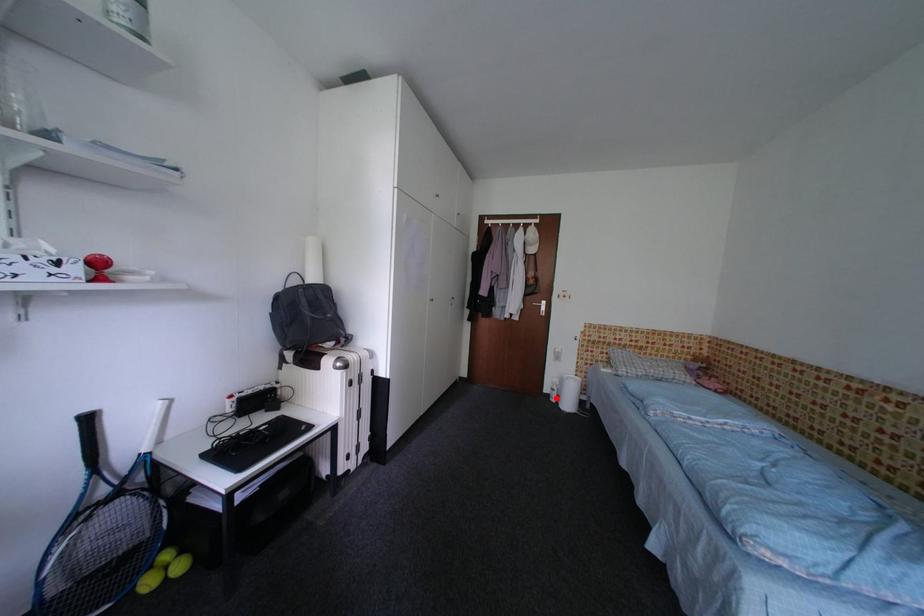
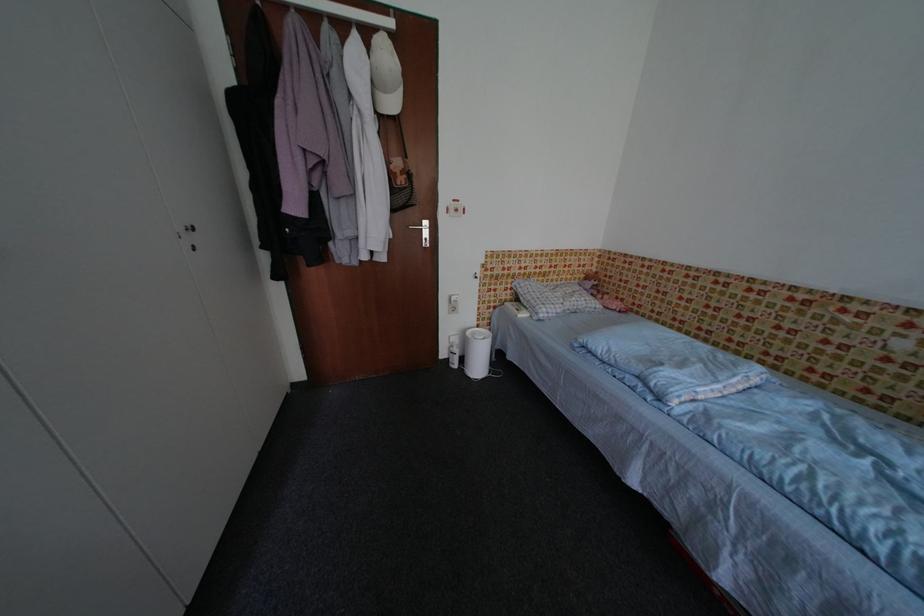
Question: A red point is marked in image1. In image2, is the corresponding 3D point closer to the camera or farther? Reply with the corresponding letter.

Choices:
 (A) The corresponding 3D point is closer.
 (B) The corresponding 3D point is farther.

Answer: (B)